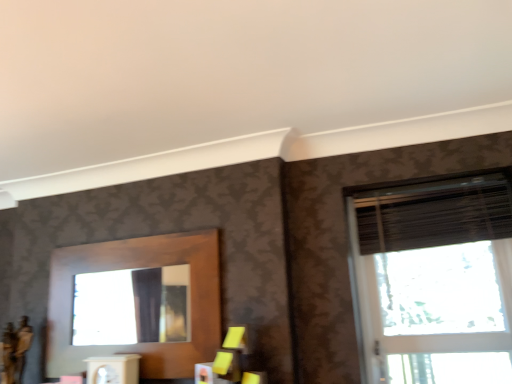
At what (x,y) coordinates should I click in order to perform the action: click on black textured blind at upper right. Please return your answer as a coordinate pair (x, y). The height and width of the screenshot is (384, 512). Looking at the image, I should click on (436, 221).

Describe the element at coordinates (436, 221) in the screenshot. I see `black textured blind at upper right` at that location.

Where is `matte black window at right`? The width and height of the screenshot is (512, 384). matte black window at right is located at coordinates (433, 278).

What do you see at coordinates (433, 278) in the screenshot? I see `matte black window at right` at bounding box center [433, 278].

Locate an element on the screen. The height and width of the screenshot is (384, 512). black textured blind at upper right is located at coordinates (436, 221).

Consider the image. Which is more to the left, matte black window at right or black textured blind at upper right?

From the viewer's perspective, black textured blind at upper right appears more on the left side.

Which object is closer to the camera taking this photo, matte black window at right or black textured blind at upper right?

matte black window at right is in front.

Considering the points (460, 309) and (425, 214), which point is behind, point (460, 309) or point (425, 214)?

Point (425, 214)

From the image's perspective, between matte black window at right and black textured blind at upper right, which one is located above?

From the image's view, black textured blind at upper right is above.

From a real-world perspective, is matte black window at right on top of black textured blind at upper right?

Incorrect, from a real-world perspective, matte black window at right is lower than black textured blind at upper right.

Can you confirm if matte black window at right is thinner than black textured blind at upper right?

Indeed, matte black window at right has a lesser width compared to black textured blind at upper right.

From their relative heights in the image, would you say matte black window at right is taller or shorter than black textured blind at upper right?

Considering their sizes, matte black window at right has more height than black textured blind at upper right.

Considering the relative sizes of matte black window at right and black textured blind at upper right in the image provided, is matte black window at right smaller than black textured blind at upper right?

Actually, matte black window at right might be larger than black textured blind at upper right.

Choose the correct answer: Is matte black window at right inside black textured blind at upper right or outside it?

matte black window at right is located beyond the bounds of black textured blind at upper right.

Would you say matte black window at right is a long distance from black textured blind at upper right?

That's not correct — matte black window at right is a little close to black textured blind at upper right.

Is matte black window at right looking in the opposite direction of black textured blind at upper right?

That's right, matte black window at right is facing away from black textured blind at upper right.

How different are the orientations of matte black window at right and black textured blind at upper right in degrees?

The angle between the facing direction of matte black window at right and the facing direction of black textured blind at upper right is 6e-05 degrees.

Measure the distance from matte black window at right to black textured blind at upper right.

The distance of matte black window at right from black textured blind at upper right is 4.99 inches.

This screenshot has width=512, height=384. Find the location of `window that appears in front of the black textured blind at upper right`. window that appears in front of the black textured blind at upper right is located at coordinates (433, 278).

Can you confirm if black textured blind at upper right is positioned to the left of matte black window at right?

Correct, you'll find black textured blind at upper right to the left of matte black window at right.

Considering the positions of objects black textured blind at upper right and matte black window at right in the image provided, who is in front, black textured blind at upper right or matte black window at right?

matte black window at right is closer to the camera.

Between point (500, 218) and point (419, 293), which one is positioned in front?

Positioned in front is point (500, 218).

From the image's perspective, is black textured blind at upper right under matte black window at right?

No, from the image's perspective, black textured blind at upper right is not beneath matte black window at right.

Based on the photo, from a real-world perspective, which is physically below, black textured blind at upper right or matte black window at right?

matte black window at right.

Which object is wider, black textured blind at upper right or matte black window at right?

With larger width is black textured blind at upper right.

Considering the sizes of objects black textured blind at upper right and matte black window at right in the image provided, who is shorter, black textured blind at upper right or matte black window at right?

With less height is black textured blind at upper right.

Looking at the image, does black textured blind at upper right seem bigger or smaller compared to matte black window at right?

Considering their sizes, black textured blind at upper right takes up less space than matte black window at right.

Is black textured blind at upper right not inside matte black window at right?

No, black textured blind at upper right is inside matte black window at right's boundary.

Is black textured blind at upper right beside matte black window at right?

No, black textured blind at upper right is not making contact with matte black window at right.

Is black textured blind at upper right facing towards matte black window at right?

Yes.

What's the angular difference between black textured blind at upper right and matte black window at right's facing directions?

The angular difference between black textured blind at upper right and matte black window at right is 6e-05 degrees.

Find the location of a particular element. The image size is (512, 384). window in front of the black textured blind at upper right is located at coordinates (433, 278).

Where is `blind that is above the matte black window at right (from the image's perspective)`? This screenshot has height=384, width=512. blind that is above the matte black window at right (from the image's perspective) is located at coordinates (436, 221).

In order to click on window that appears in front of the black textured blind at upper right in this screenshot , I will do point(433,278).